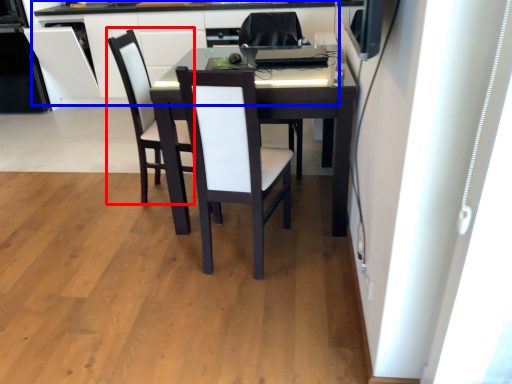
Question: Which object is closer to the camera taking this photo, armchair (highlighted by a red box) or computer desk (highlighted by a blue box)?

Choices:
 (A) armchair
 (B) computer desk

Answer: (A)